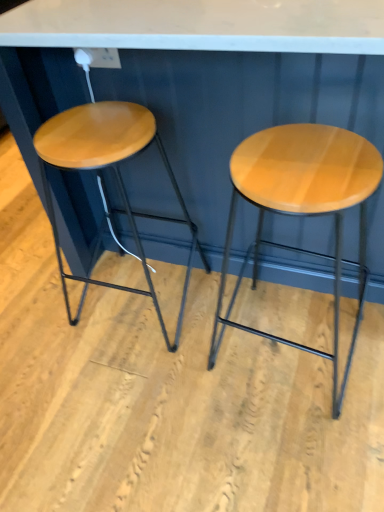
The height and width of the screenshot is (512, 384). What are the coordinates of `matte wood stool at left, the 1th stool viewed from the left` in the screenshot? It's located at (116, 177).

The width and height of the screenshot is (384, 512). Describe the element at coordinates (116, 177) in the screenshot. I see `matte wood stool at left, the 1th stool viewed from the left` at that location.

What do you see at coordinates (302, 206) in the screenshot? I see `matte wood stool at center, acting as the second stool starting from the left` at bounding box center [302, 206].

What are the coordinates of `matte wood stool at center, acting as the second stool starting from the left` in the screenshot? It's located at (302, 206).

Where is `matte wood stool at left, positioned as the 2th stool in right-to-left order`? The height and width of the screenshot is (512, 384). matte wood stool at left, positioned as the 2th stool in right-to-left order is located at coordinates (116, 177).

Considering the positions of objects matte wood stool at left, the 1th stool viewed from the left, and matte wood stool at center, the first stool positioned from the right, in the image provided, who is more to the left, matte wood stool at left, the 1th stool viewed from the left, or matte wood stool at center, the first stool positioned from the right,?

matte wood stool at left, the 1th stool viewed from the left.

Is matte wood stool at left, positioned as the 2th stool in right-to-left order, positioned in front of matte wood stool at center, acting as the second stool starting from the left?

No, matte wood stool at left, positioned as the 2th stool in right-to-left order, is behind matte wood stool at center, acting as the second stool starting from the left.

Between point (73, 110) and point (372, 149), which one is positioned behind?

The point (73, 110) is more distant.

From the image's perspective, is matte wood stool at left, positioned as the 2th stool in right-to-left order, beneath matte wood stool at center, acting as the second stool starting from the left?

No, from the image's perspective, matte wood stool at left, positioned as the 2th stool in right-to-left order, is not beneath matte wood stool at center, acting as the second stool starting from the left.

From a real-world perspective, is matte wood stool at left, positioned as the 2th stool in right-to-left order, positioned under matte wood stool at center, the first stool positioned from the right, based on gravity?

Actually, matte wood stool at left, positioned as the 2th stool in right-to-left order, is physically above matte wood stool at center, the first stool positioned from the right, in the real world.

Is matte wood stool at left, the 1th stool viewed from the left, wider or thinner than matte wood stool at center, the first stool positioned from the right?

In the image, matte wood stool at left, the 1th stool viewed from the left, appears to be more narrow than matte wood stool at center, the first stool positioned from the right.

Considering the relative sizes of matte wood stool at left, the 1th stool viewed from the left, and matte wood stool at center, acting as the second stool starting from the left, in the image provided, is matte wood stool at left, the 1th stool viewed from the left, shorter than matte wood stool at center, acting as the second stool starting from the left,?

Yes, matte wood stool at left, the 1th stool viewed from the left, is shorter than matte wood stool at center, acting as the second stool starting from the left.

Looking at the image, does matte wood stool at left, positioned as the 2th stool in right-to-left order, seem bigger or smaller compared to matte wood stool at center, acting as the second stool starting from the left?

Considering their sizes, matte wood stool at left, positioned as the 2th stool in right-to-left order, takes up less space than matte wood stool at center, acting as the second stool starting from the left.

Is matte wood stool at center, acting as the second stool starting from the left, completely or partially inside matte wood stool at left, the 1th stool viewed from the left?

No, matte wood stool at center, acting as the second stool starting from the left, is not a part of matte wood stool at left, the 1th stool viewed from the left.

Is matte wood stool at left, the 1th stool viewed from the left, in contact with matte wood stool at center, acting as the second stool starting from the left?

No, matte wood stool at left, the 1th stool viewed from the left, is not touching matte wood stool at center, acting as the second stool starting from the left.

In the scene shown: Is matte wood stool at center, the first stool positioned from the right, at the back of matte wood stool at left, the 1th stool viewed from the left?

matte wood stool at left, the 1th stool viewed from the left, does not have its back to matte wood stool at center, the first stool positioned from the right.

What's the angular difference between matte wood stool at left, positioned as the 2th stool in right-to-left order, and matte wood stool at center, acting as the second stool starting from the left,'s facing directions?

0.00218 degrees.

Find the location of a particular element. The image size is (384, 512). stool to the right of matte wood stool at left, the 1th stool viewed from the left is located at coordinates (302, 206).

Which is more to the left, matte wood stool at center, acting as the second stool starting from the left, or matte wood stool at left, the 1th stool viewed from the left?

From the viewer's perspective, matte wood stool at left, the 1th stool viewed from the left, appears more on the left side.

Looking at this image, considering the positions of objects matte wood stool at center, the first stool positioned from the right, and matte wood stool at left, the 1th stool viewed from the left, in the image provided, who is in front, matte wood stool at center, the first stool positioned from the right, or matte wood stool at left, the 1th stool viewed from the left,?

Positioned in front is matte wood stool at center, the first stool positioned from the right.

Is point (294, 146) more distant than point (147, 131)?

No, (294, 146) is in front of (147, 131).

From the image's perspective, is matte wood stool at center, the first stool positioned from the right, above or below matte wood stool at left, positioned as the 2th stool in right-to-left order?

From the image's perspective, matte wood stool at center, the first stool positioned from the right, appears below matte wood stool at left, positioned as the 2th stool in right-to-left order.

From a real-world perspective, who is located lower, matte wood stool at center, the first stool positioned from the right, or matte wood stool at left, positioned as the 2th stool in right-to-left order?

matte wood stool at center, the first stool positioned from the right, is physically lower.

Looking at their sizes, would you say matte wood stool at center, the first stool positioned from the right, is wider or thinner than matte wood stool at left, the 1th stool viewed from the left?

In the image, matte wood stool at center, the first stool positioned from the right, appears to be wider than matte wood stool at left, the 1th stool viewed from the left.

Can you confirm if matte wood stool at center, acting as the second stool starting from the left, is shorter than matte wood stool at left, the 1th stool viewed from the left?

No.

Is matte wood stool at center, acting as the second stool starting from the left, smaller than matte wood stool at left, the 1th stool viewed from the left?

No, matte wood stool at center, acting as the second stool starting from the left, is not smaller than matte wood stool at left, the 1th stool viewed from the left.

Is matte wood stool at left, positioned as the 2th stool in right-to-left order, surrounded by matte wood stool at center, acting as the second stool starting from the left?

No, matte wood stool at left, positioned as the 2th stool in right-to-left order, is not inside matte wood stool at center, acting as the second stool starting from the left.

Is matte wood stool at center, the first stool positioned from the right, not near matte wood stool at left, positioned as the 2th stool in right-to-left order?

No, matte wood stool at center, the first stool positioned from the right, is in close proximity to matte wood stool at left, positioned as the 2th stool in right-to-left order.

Is matte wood stool at center, the first stool positioned from the right, looking in the opposite direction of matte wood stool at left, the 1th stool viewed from the left?

No.

Can you tell me how much matte wood stool at center, acting as the second stool starting from the left, and matte wood stool at left, positioned as the 2th stool in right-to-left order, differ in facing direction?

0.00218 degrees separate the facing orientations of matte wood stool at center, acting as the second stool starting from the left, and matte wood stool at left, positioned as the 2th stool in right-to-left order.

How distant is matte wood stool at center, the first stool positioned from the right, from matte wood stool at left, the 1th stool viewed from the left?

15.69 inches.

The image size is (384, 512). In order to click on stool below the matte wood stool at left, the 1th stool viewed from the left (from the image's perspective) in this screenshot , I will do `click(302, 206)`.

The width and height of the screenshot is (384, 512). I want to click on stool below the matte wood stool at left, positioned as the 2th stool in right-to-left order (from the image's perspective), so 302,206.

You are a GUI agent. You are given a task and a screenshot of the screen. Output one action in this format:
    pyautogui.click(x=<x>, y=<y>)
    Task: Click on the stool lying behind the matte wood stool at center, the first stool positioned from the right
    
    Given the screenshot: What is the action you would take?
    pyautogui.click(x=116, y=177)